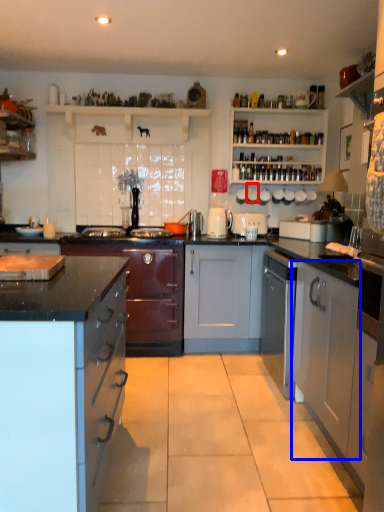
Question: Which object appears farthest to the camera in this image, appliance (highlighted by a red box) or cabinetry (highlighted by a blue box)?

Choices:
 (A) appliance
 (B) cabinetry

Answer: (A)